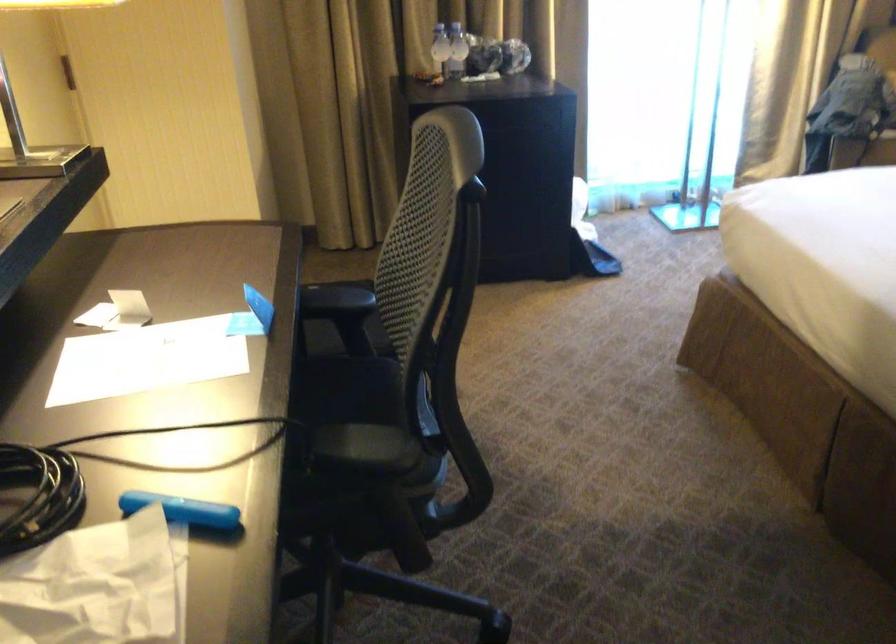
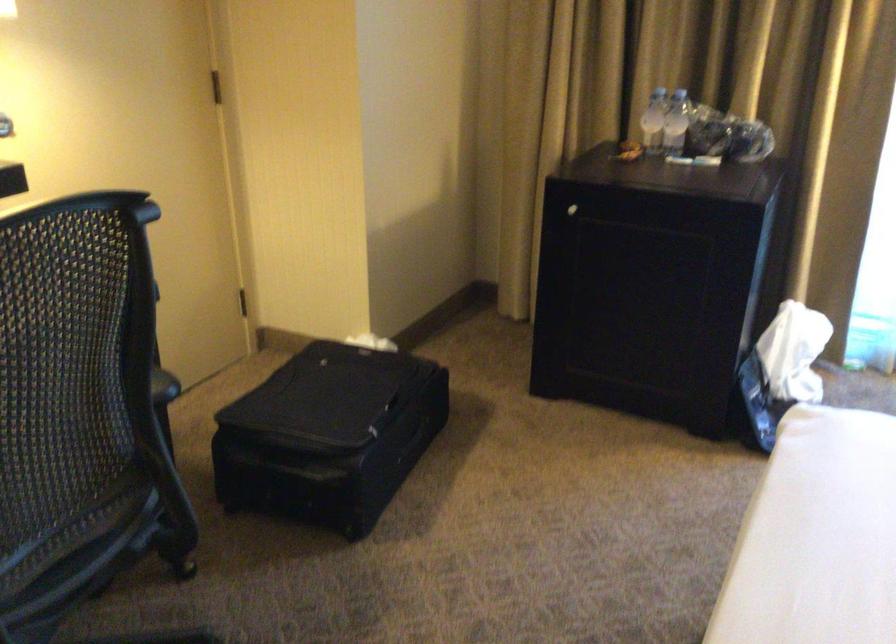
Locate, in the second image, the point that corresponds to point 378,342 in the first image.

(329, 436)